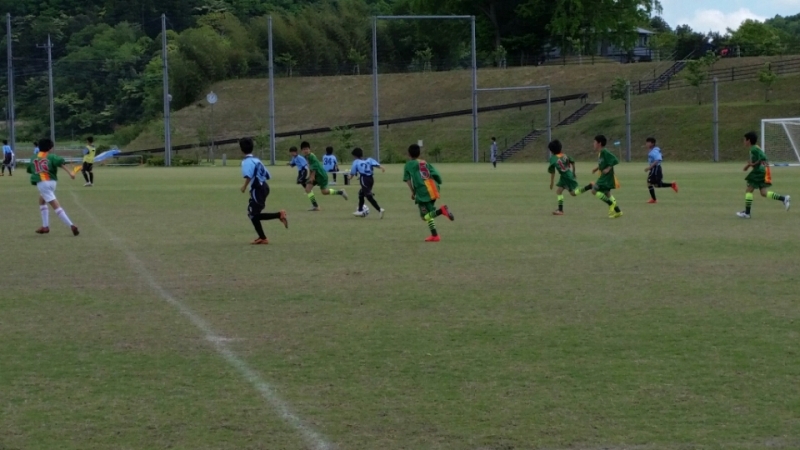
Image resolution: width=800 pixels, height=450 pixels. What are the coordinates of `stair case` in the screenshot? It's located at (578, 113).